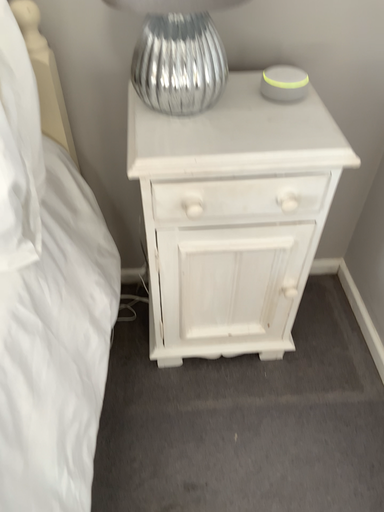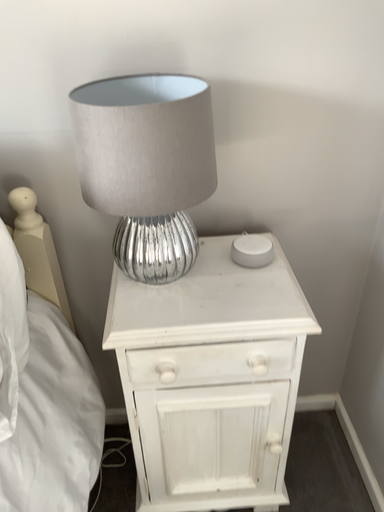
Question: How did the camera likely rotate when shooting the video?

Choices:
 (A) rotated downward
 (B) rotated upward

Answer: (B)